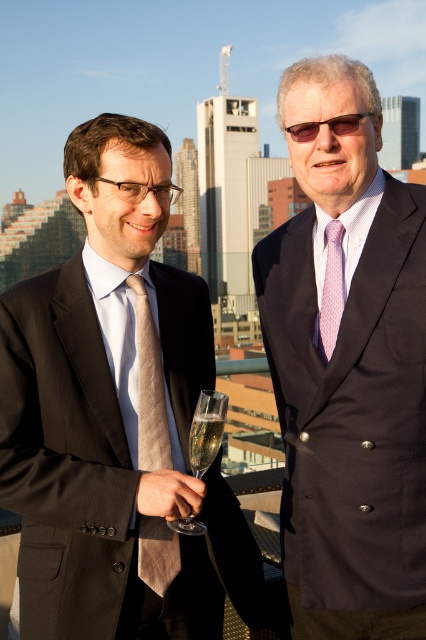
Question: Which of the following is the farthest from the observer?

Choices:
 (A) (146, 385)
 (B) (296, 589)
 (C) (166, 520)

Answer: (B)

Question: Is matte black suit at center to the left of clear glass wine glass at center from the viewer's perspective?

Choices:
 (A) yes
 (B) no

Answer: (B)

Question: Considering the real-world distances, which object is farthest from the clear glass at center?

Choices:
 (A) dark gray wool suit at left
 (B) clear glass wine glass at center
 (C) matte black suit at center
 (D) pink striped tie at center

Answer: (C)

Question: Can you confirm if clear glass wine glass at center is wider than clear glass at center?

Choices:
 (A) yes
 (B) no

Answer: (A)

Question: Can you confirm if matte black suit at center is smaller than dark gray wool suit at left?

Choices:
 (A) no
 (B) yes

Answer: (A)

Question: Which point is closer to the camera taking this photo?

Choices:
 (A) (189, 435)
 (B) (405, 296)

Answer: (A)